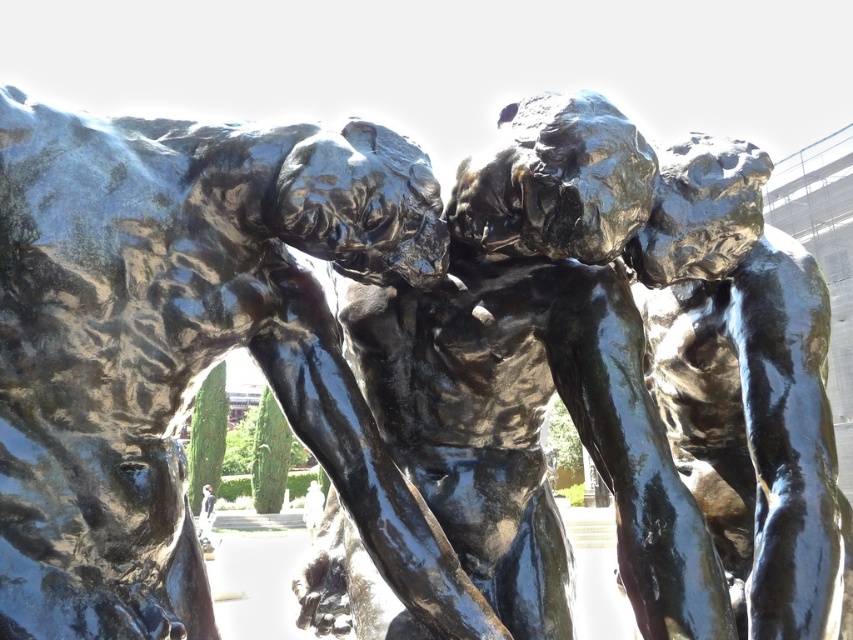
You are an art student analyzing the sculpture. You notice two parts of the sculpture labeled as the glossy bronze statue at center and the shiny bronze torso at center. Which part is positioned lower in the sculpture?

The glossy bronze statue at center is located below the shiny bronze torso at center, so the glossy bronze statue at center is positioned lower in the sculpture.